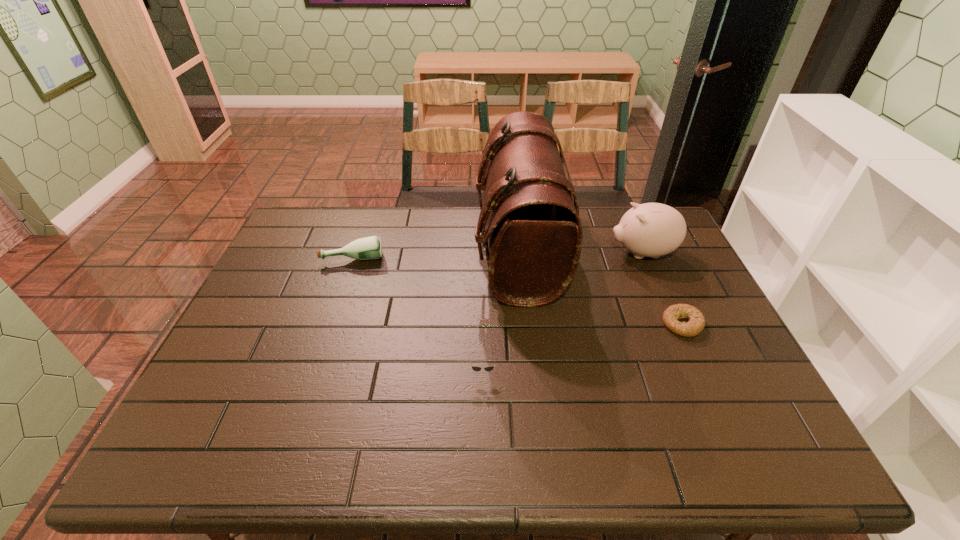
The height and width of the screenshot is (540, 960). Find the location of `vacant area that lies between the leftmost object and the sunglasses`. vacant area that lies between the leftmost object and the sunglasses is located at coordinates (418, 314).

This screenshot has width=960, height=540. I want to click on object that is the third nearest to the bottle, so click(x=652, y=230).

Where is `object that stands as the second closest to the fourth shortest object`? object that stands as the second closest to the fourth shortest object is located at coordinates pyautogui.click(x=695, y=325).

The width and height of the screenshot is (960, 540). What are the coordinates of `free point that satisfies the following two spatial constraints: 1. on the front-facing side of the satchel; 2. on the left side of the bagel` in the screenshot? It's located at (525, 324).

The image size is (960, 540). What are the coordinates of `free space that satisfies the following two spatial constraints: 1. on the front-facing side of the satchel; 2. in front of the lenses of the nearest object` in the screenshot? It's located at (531, 372).

Where is `free space that satisfies the following two spatial constraints: 1. on the front-facing side of the satchel; 2. in front of the lenses of the second shortest object`? Image resolution: width=960 pixels, height=540 pixels. free space that satisfies the following two spatial constraints: 1. on the front-facing side of the satchel; 2. in front of the lenses of the second shortest object is located at coordinates (531, 372).

Where is `free point that satisfies the following two spatial constraints: 1. on the front-facing side of the satchel; 2. on the right side of the bagel`? free point that satisfies the following two spatial constraints: 1. on the front-facing side of the satchel; 2. on the right side of the bagel is located at coordinates (525, 324).

The height and width of the screenshot is (540, 960). I want to click on free space that satisfies the following two spatial constraints: 1. at the snout of the second tallest object; 2. on the back side of the bagel, so click(x=672, y=324).

Find the location of a particular element. vacant space that satisfies the following two spatial constraints: 1. at the snout of the fourth shortest object; 2. on the front side of the bottle is located at coordinates (644, 258).

You are a GUI agent. You are given a task and a screenshot of the screen. Output one action in this format:
    pyautogui.click(x=<x>, y=<y>)
    Task: Click on the blank area in the image that satisfies the following two spatial constraints: 1. on the front-facing side of the satchel; 2. on the left side of the bagel
    
    Given the screenshot: What is the action you would take?
    pos(525,324)